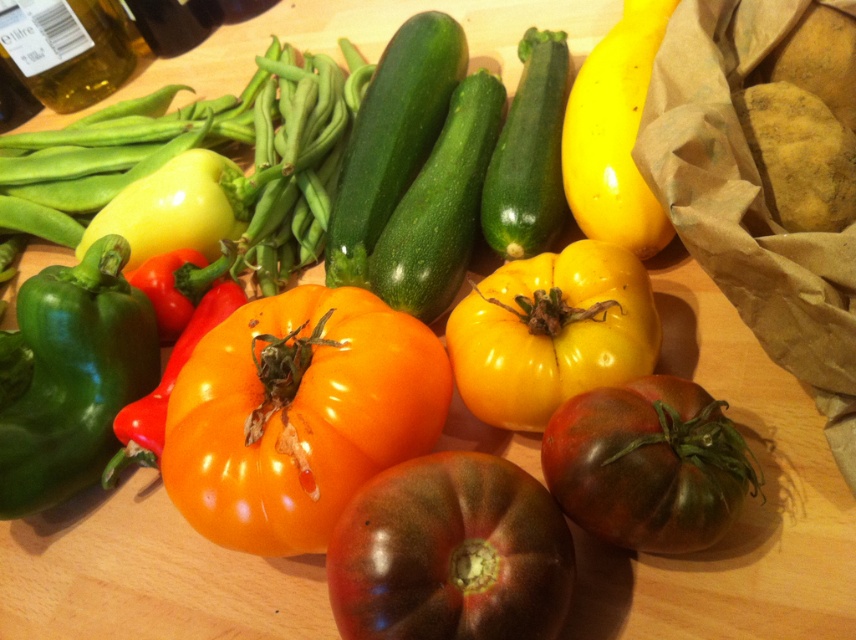
You are arranging vegetables on a wooden counter and need to place the dark green matte tomato at center and the yellow smooth pepper at upper right. According to the image, which vegetable is located to the right of the other?

The yellow smooth pepper at upper right is located to the right of the dark green matte tomato at center.

Please look at the image and locate the point at coordinates (x=646, y=465). What object is located there?

The point at coordinates (x=646, y=465) corresponds to the dark green matte tomato at center.

From the picture: You are a chef preparing a dish and need to know which tomato is shorter. You have two tomatoes in front of you on the counter, the dark red matte tomato at center and the yellow matte tomato at center. Which one is shorter?

The dark red matte tomato at center is not as tall as yellow matte tomato at center, so the dark red matte tomato at center is shorter.